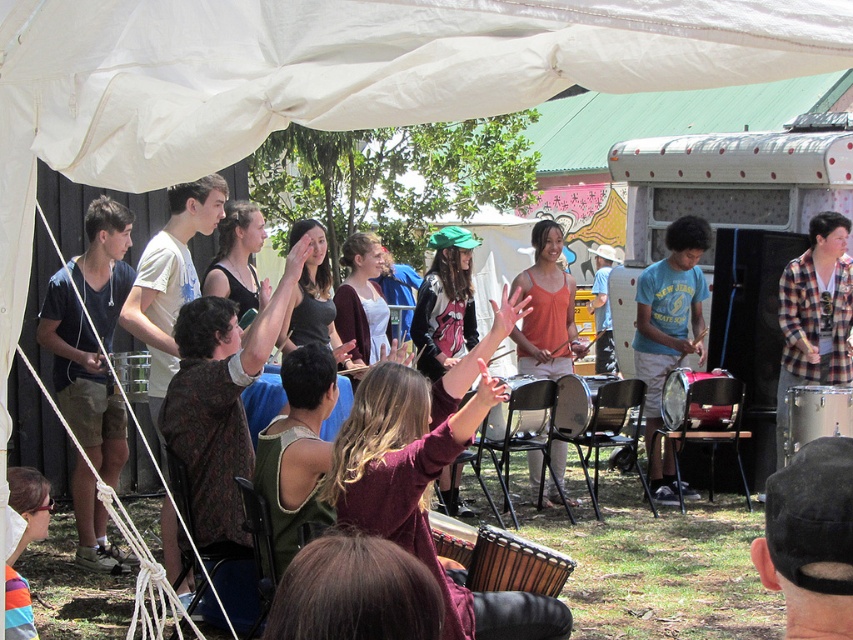
In the scene under the large white canopy tent, there is a point marked at coordinates (24, 545). Which object from the following list is this point located on? The options are rainbow striped shirt at lower left and maroon dress at lower right.

The point at (24, 545) is located on the rainbow striped shirt at lower left.

You are standing at the center of the tent and want to find the rainbow striped shirt at lower left. Which direction should you look to see it?

The rainbow striped shirt at lower left is located at point 0.853 on the x axis and 0.029 on the y axis, so you should look towards the lower left direction to see it.